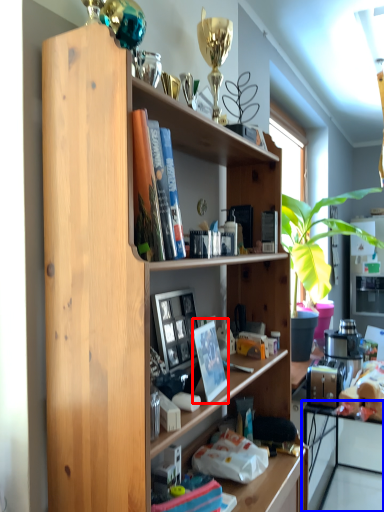
Question: Which of the following is the farthest to the observer, paperback book (highlighted by a red box) or computer (highlighted by a blue box)?

Choices:
 (A) paperback book
 (B) computer

Answer: (B)